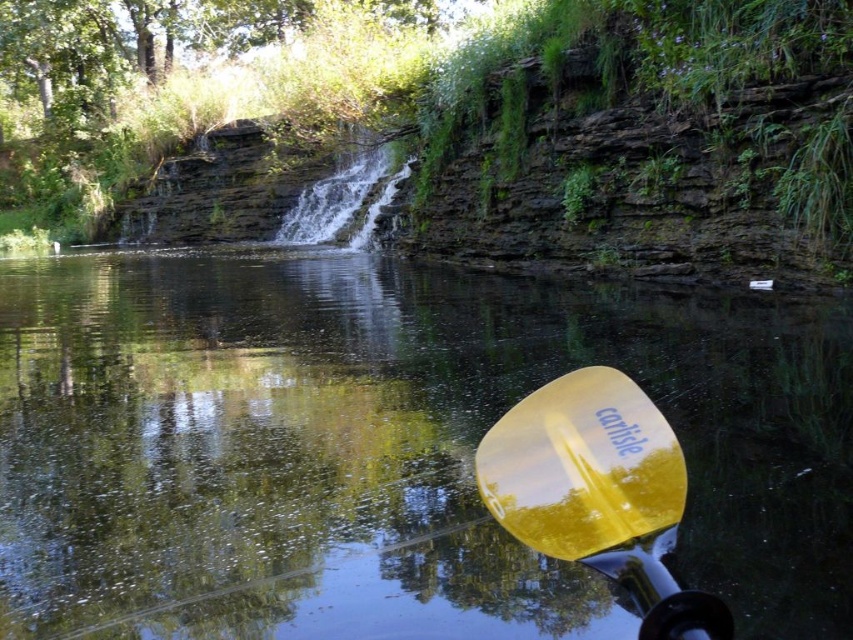
Is transparent plastic paddle at lower right to the left of yellow glossy paddle at lower right from the viewer's perspective?

Correct, you'll find transparent plastic paddle at lower right to the left of yellow glossy paddle at lower right.

Does transparent plastic paddle at lower right lie in front of yellow glossy paddle at lower right?

No, it is not.

Which is in front, point (378, 483) or point (500, 448)?

Point (500, 448)

What are the coordinates of `transparent plastic paddle at lower right` in the screenshot? It's located at (386, 449).